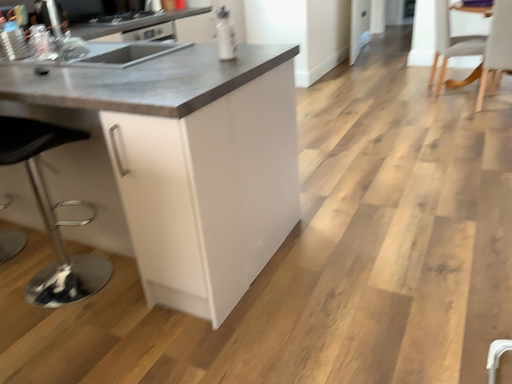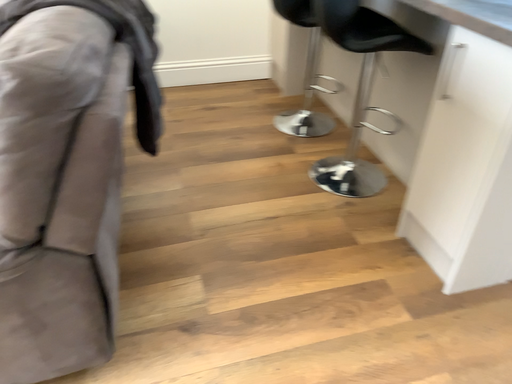
Question: Which way did the camera rotate in the video?

Choices:
 (A) rotated left
 (B) rotated right

Answer: (A)